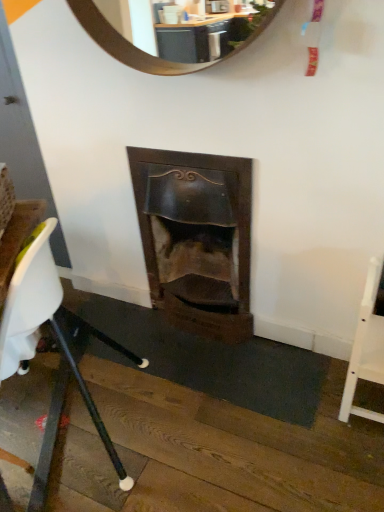
Measure the distance between point (229, 189) and camera.

The depth of point (229, 189) is 5.10 feet.

Locate an element on the screen. The width and height of the screenshot is (384, 512). wooden fireplace at center is located at coordinates (196, 238).

From a real-world perspective, which object rests below the other?

In real-world perspective, wooden fireplace at center is lower.

In the scene shown: How many degrees apart are the facing directions of wooden fireplace at center and white plastic chair at lower left, which is the second chair in right-to-left order?

wooden fireplace at center and white plastic chair at lower left, which is the second chair in right-to-left order, are facing 66.4 degrees away from each other.

Which object is thinner, wooden fireplace at center or white plastic chair at lower left, acting as the first chair starting from the left?

wooden fireplace at center is thinner.

Image resolution: width=384 pixels, height=512 pixels. I want to click on fireplace that appears on the right of white plastic chair at lower left, which is the second chair in right-to-left order, so click(x=196, y=238).

Consider the image. Does white wood chair at right, the first chair viewed from the right, have a larger size compared to white plastic chair at lower left, acting as the first chair starting from the left?

No, white wood chair at right, the first chair viewed from the right, is not bigger than white plastic chair at lower left, acting as the first chair starting from the left.

Considering the positions of objects white wood chair at right, placed as the 2th chair when sorted from left to right, and white plastic chair at lower left, which is the second chair in right-to-left order, in the image provided, who is behind, white wood chair at right, placed as the 2th chair when sorted from left to right, or white plastic chair at lower left, which is the second chair in right-to-left order,?

white wood chair at right, placed as the 2th chair when sorted from left to right.

Could you tell me if white wood chair at right, placed as the 2th chair when sorted from left to right, is facing white plastic chair at lower left, which is the second chair in right-to-left order?

No, white wood chair at right, placed as the 2th chair when sorted from left to right, is not aimed at white plastic chair at lower left, which is the second chair in right-to-left order.

Find the location of a particular element. chair on the right of white plastic chair at lower left, which is the second chair in right-to-left order is located at coordinates pyautogui.click(x=366, y=348).

How different are the orientations of white wood chair at right, placed as the 2th chair when sorted from left to right, and wooden fireplace at center in degrees?

The facing directions of white wood chair at right, placed as the 2th chair when sorted from left to right, and wooden fireplace at center are 88.9 degrees apart.

From a real-world perspective, is white wood chair at right, the first chair viewed from the right, physically above wooden fireplace at center?

Actually, white wood chair at right, the first chair viewed from the right, is physically below wooden fireplace at center in the real world.

Between white wood chair at right, placed as the 2th chair when sorted from left to right, and wooden fireplace at center, which one has more height?

wooden fireplace at center.

Relative to wooden fireplace at center, is white wood chair at right, the first chair viewed from the right, in front or behind?

white wood chair at right, the first chair viewed from the right, is in front of wooden fireplace at center.

Between white plastic chair at lower left, which is the second chair in right-to-left order, and wooden fireplace at center, which one has less height?

wooden fireplace at center.

Considering the sizes of objects white plastic chair at lower left, acting as the first chair starting from the left, and wooden fireplace at center in the image provided, who is smaller, white plastic chair at lower left, acting as the first chair starting from the left, or wooden fireplace at center?

wooden fireplace at center.

Does white plastic chair at lower left, which is the second chair in right-to-left order, appear on the left side of wooden fireplace at center?

Yes.

Which is nearer, (19,300) or (223,336)?

Point (19,300) appears to be closer to the viewer than point (223,336).

Does white plastic chair at lower left, which is the second chair in right-to-left order, have a lesser height compared to white wood chair at right, placed as the 2th chair when sorted from left to right?

Incorrect, the height of white plastic chair at lower left, which is the second chair in right-to-left order, does not fall short of that of white wood chair at right, placed as the 2th chair when sorted from left to right.

Does white plastic chair at lower left, acting as the first chair starting from the left, have a greater width compared to white wood chair at right, placed as the 2th chair when sorted from left to right?

Yes, white plastic chair at lower left, acting as the first chair starting from the left, is wider than white wood chair at right, placed as the 2th chair when sorted from left to right.

Is wooden fireplace at center located outside white wood chair at right, placed as the 2th chair when sorted from left to right?

That's correct, wooden fireplace at center is outside of white wood chair at right, placed as the 2th chair when sorted from left to right.

Is the depth of wooden fireplace at center less than that of white wood chair at right, the first chair viewed from the right?

That is False.

Is wooden fireplace at center positioned with its back to white wood chair at right, the first chair viewed from the right?

No.

Measure the distance from wooden fireplace at center to white wood chair at right, the first chair viewed from the right.

wooden fireplace at center is 66.03 centimeters from white wood chair at right, the first chair viewed from the right.

Find the location of `fireplace below the white plastic chair at lower left, which is the second chair in right-to-left order (from a real-world perspective)`. fireplace below the white plastic chair at lower left, which is the second chair in right-to-left order (from a real-world perspective) is located at coordinates (196, 238).

This screenshot has width=384, height=512. Identify the location of chair above the white wood chair at right, placed as the 2th chair when sorted from left to right (from a real-world perspective). (43, 323).

Looking at this image, considering their positions, is white wood chair at right, the first chair viewed from the right, positioned closer to white plastic chair at lower left, acting as the first chair starting from the left, than wooden fireplace at center?

Based on the image, wooden fireplace at center appears to be nearer to white plastic chair at lower left, acting as the first chair starting from the left.

Consider the image. Looking at the image, which one is located closer to wooden fireplace at center, white wood chair at right, placed as the 2th chair when sorted from left to right, or white plastic chair at lower left, which is the second chair in right-to-left order?

white plastic chair at lower left, which is the second chair in right-to-left order, is closer to wooden fireplace at center.

Consider the image. Considering their positions, is wooden fireplace at center positioned closer to white wood chair at right, placed as the 2th chair when sorted from left to right, than white plastic chair at lower left, which is the second chair in right-to-left order?

wooden fireplace at center lies closer to white wood chair at right, placed as the 2th chair when sorted from left to right, than the other object.

Estimate the real-world distances between objects in this image. Which object is further from white plastic chair at lower left, acting as the first chair starting from the left, wooden fireplace at center or white wood chair at right, placed as the 2th chair when sorted from left to right?

white wood chair at right, placed as the 2th chair when sorted from left to right.

Which object lies further to the anchor point white wood chair at right, placed as the 2th chair when sorted from left to right, white plastic chair at lower left, acting as the first chair starting from the left, or wooden fireplace at center?

white plastic chair at lower left, acting as the first chair starting from the left.

Looking at the image, which one is located closer to wooden fireplace at center, white plastic chair at lower left, which is the second chair in right-to-left order, or white wood chair at right, placed as the 2th chair when sorted from left to right?

Among the two, white plastic chair at lower left, which is the second chair in right-to-left order, is located nearer to wooden fireplace at center.

Where is `fireplace situated between white plastic chair at lower left, acting as the first chair starting from the left, and white wood chair at right, the first chair viewed from the right, from left to right`? Image resolution: width=384 pixels, height=512 pixels. fireplace situated between white plastic chair at lower left, acting as the first chair starting from the left, and white wood chair at right, the first chair viewed from the right, from left to right is located at coordinates 196,238.